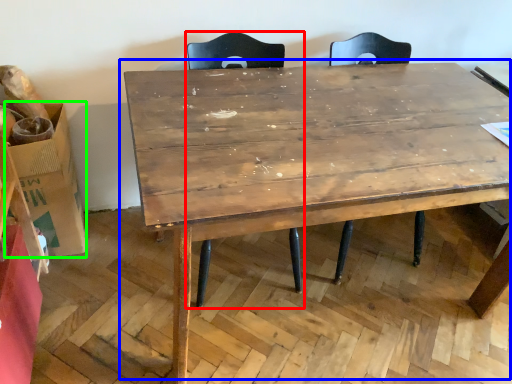
Question: Estimate the real-world distances between objects in this image. Which object is closer to swivel chair (highlighted by a red box), table (highlighted by a blue box) or cardboard box (highlighted by a green box)?

Choices:
 (A) table
 (B) cardboard box

Answer: (A)